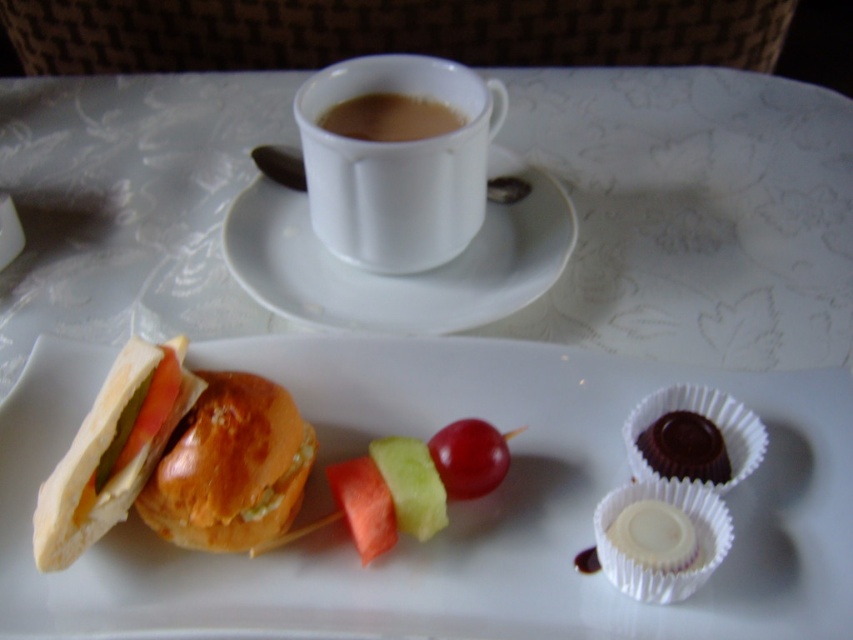
From the picture: You are a food delivery person who needs to ensure the red shiny grape at center doesn t roll off the white paper plate at center. What should you be aware of based on their sizes?

The white paper plate at center is taller than the red shiny grape at center, so the grape is less likely to roll off since the plate has a raised edge to contain it.

You are holding a small toy that is 20 inches long and want to place it on the tray. Can you place it along the line from the viewer to the point at coordinates point (613,496)? Explain your reasoning.

The distance from the viewer to point (613,496) is 22.93 inches, which is longer than the toy length of 20 inches. Therefore, the toy can be placed along that line as it will fit within the available space.

You are a guest at a tea party and see both the white glossy mug at upper center and the matte white cup at upper center on the tray. Which one would you choose if you want to drink hot tea?

The white glossy mug at upper center is much taller than the matte white cup at upper center, so it would be better to choose the white glossy mug at upper center for drinking hot tea because taller containers typically hold more liquid and are designed for beverages like tea.